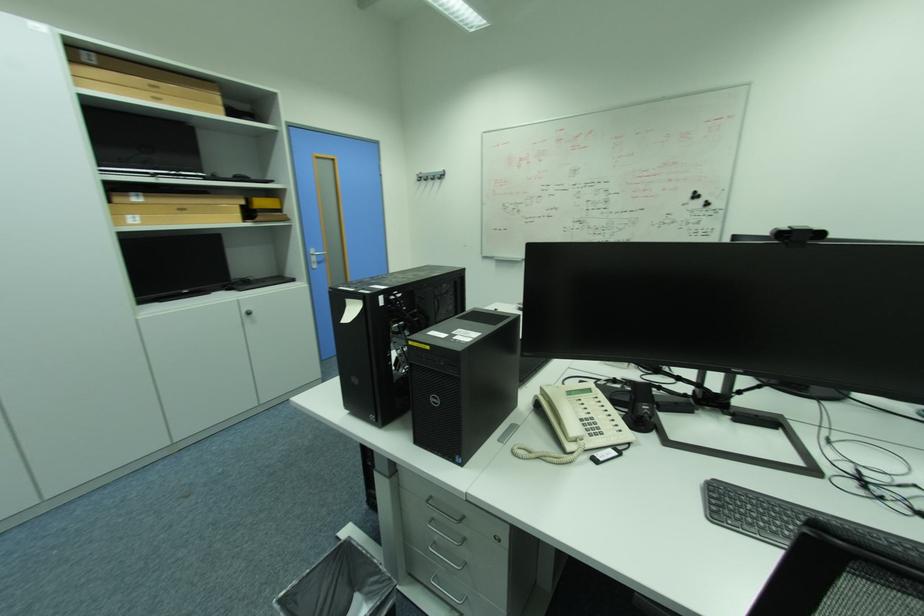
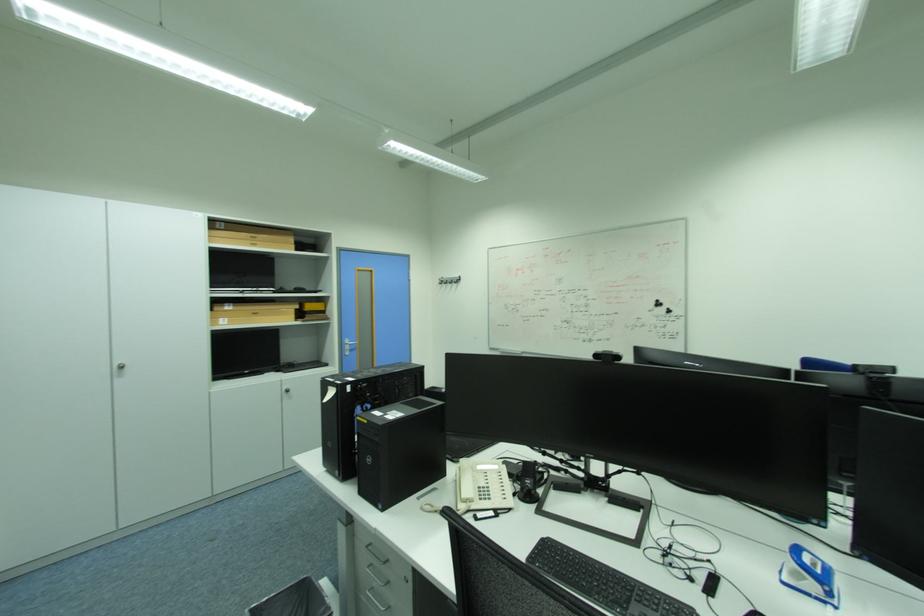
In the second image, find the point that corresponds to [444,538] in the first image.

(382, 585)